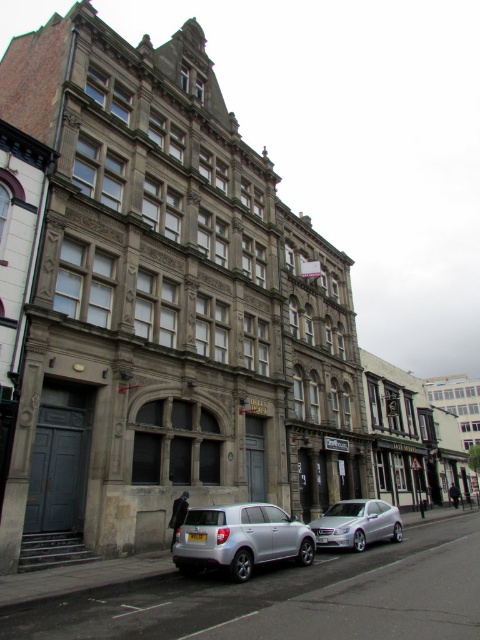
You are standing on the sidewalk in the street scene and want to walk towards the building. Which of the two points, point (240, 538) or point (364, 532), would you reach first?

You would reach point (240, 538) first because it is closer to the viewer than point (364, 532).

You are standing at the point marked by the coordinates point (240, 538) in the image. Which object is exactly at that location?

The satin silver suv at lower center is located at point (240, 538).

You are a delivery person who needs to park your vehicle in front of the building. The parking spot is located at point 0.842, 0.500. Is the satin silver suv at lower center currently occupying that spot?

Yes, the satin silver suv at lower center is occupying the parking spot at point (240, 538) as stated in the description.